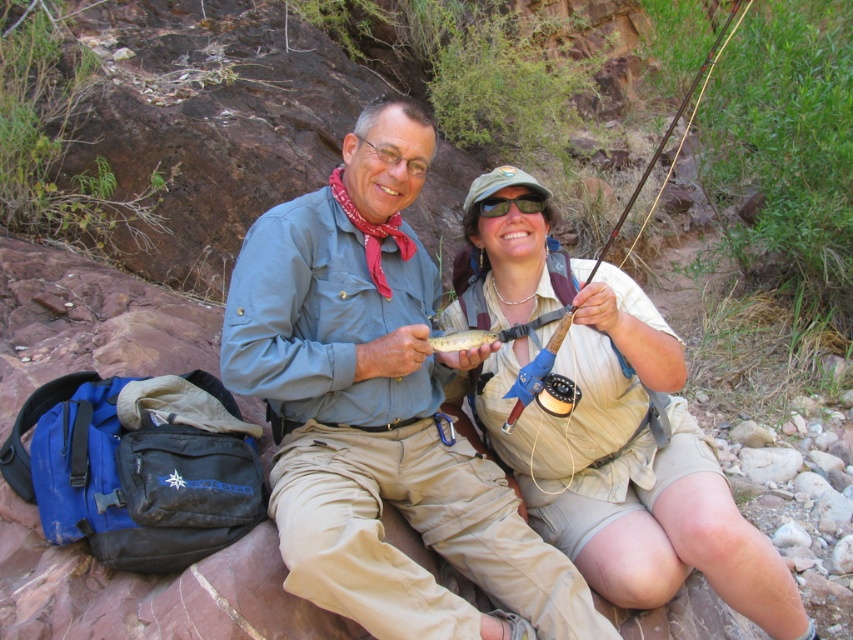
Question: Is tan fabric shirt at center to the right of shiny silver fish at center from the viewer's perspective?

Choices:
 (A) yes
 (B) no

Answer: (A)

Question: Which point is farther from the camera taking this photo?

Choices:
 (A) (573, 317)
 (B) (422, 292)

Answer: (B)

Question: Is wooden fly rod at center in front of shiny silver fish at center?

Choices:
 (A) yes
 (B) no

Answer: (A)

Question: Which of the following is the closest to the observer?

Choices:
 (A) wooden fly rod at center
 (B) shiny silver fish at center

Answer: (A)

Question: Which object is the farthest from the matte khaki pants at center?

Choices:
 (A) wooden fly rod at center
 (B) tan fabric shirt at center
 (C) shiny silver fish at center

Answer: (A)

Question: Does matte khaki pants at center appear on the left side of wooden fly rod at center?

Choices:
 (A) no
 (B) yes

Answer: (B)